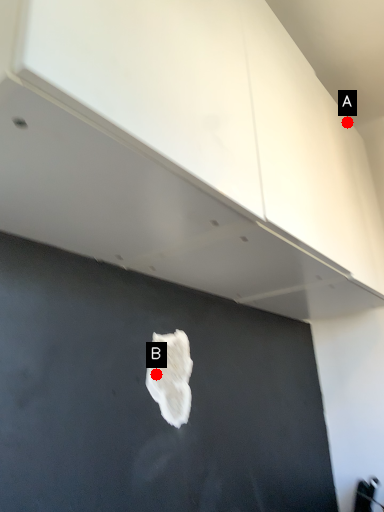
Question: Two points are circled on the image, labeled by A and B beside each circle. Among these points, which one is nearest to the camera?

Choices:
 (A) A is closer
 (B) B is closer

Answer: (B)